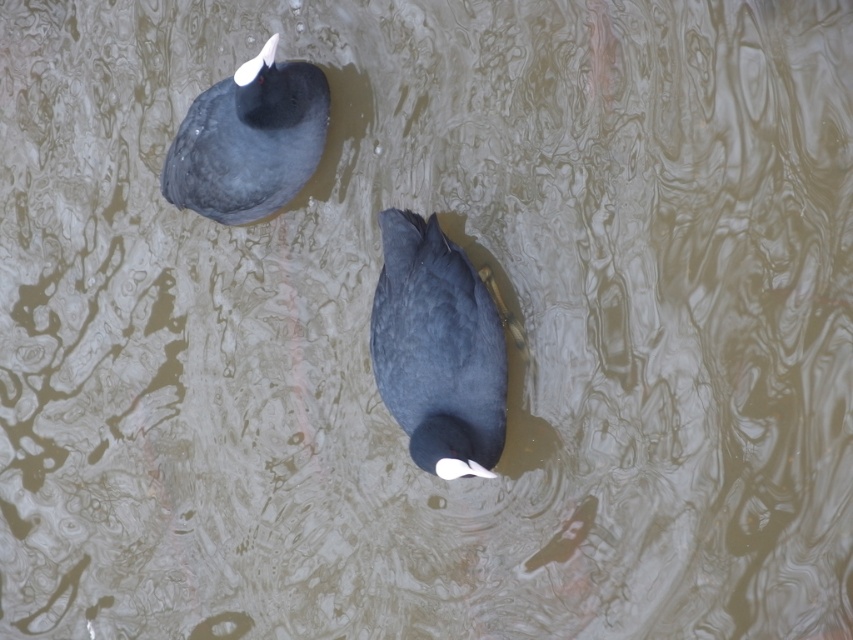
Who is more distant from viewer, [450,268] or [196,198]?

The point [196,198] is behind.

Is point (440, 289) positioned after point (184, 122)?

No, (440, 289) is in front of (184, 122).

At what (x,y) coordinates should I click in order to perform the action: click on matte black duck at center. Please return your answer as a coordinate pair (x, y). Looking at the image, I should click on (438, 348).